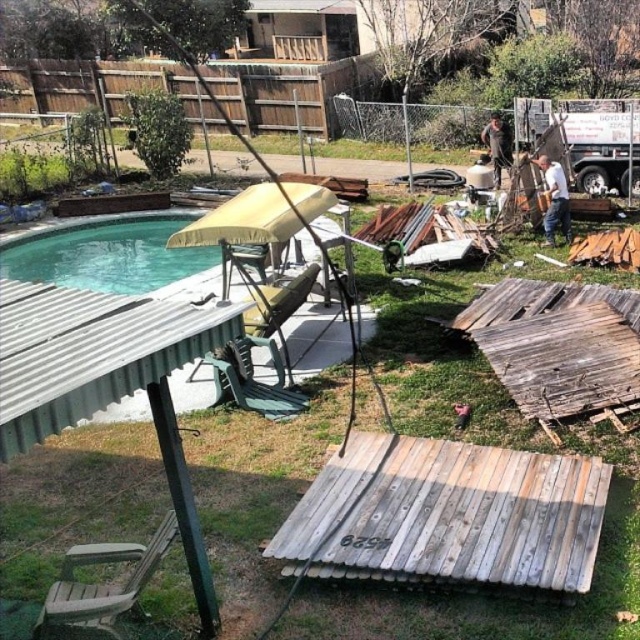
You are standing at point (150,268) and want to walk to the swimming pool. Is the point (38,476) between you and the swimming pool?

Yes, point (38,476) is between you and the swimming pool because it is in front of point (150,268) where you are standing.

You are planning to set up a small garden in the backyard. You have two options for the location of the garden bed. One is on the green grass at center, and the other is on the green plastic pool at center. Which location would be better for the garden bed to ensure it is elevated above ground level?

The green plastic pool at center would be better for the garden bed since the green grass at center is not as tall as the green plastic pool at center, meaning the pool provides a higher elevation.

You are a gardener who needs to place a new decorative rock in the backyard. The rock is too heavy to lift, so you must roll it from the green grass at center to the brown leather jacket at upper right. Will the rock naturally roll towards the jacket?

The green grass at center is in front of the brown leather jacket at upper right, which means the grass is closer to the observer. Since the grass is higher in elevation, the rock would naturally roll away from the jacket, not towards it.